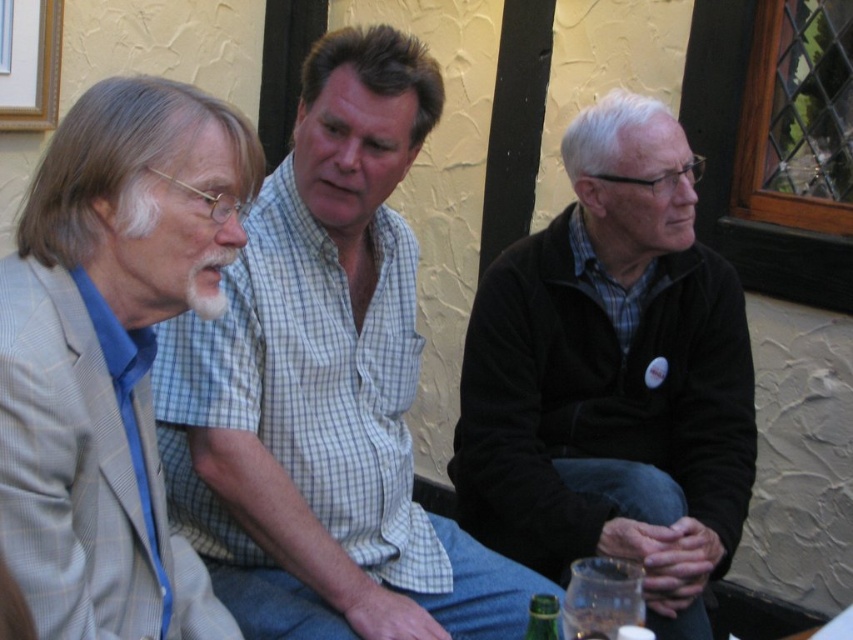
Based on the scene description, where exactly is the black fleece jacket at center located in terms of coordinates?

The black fleece jacket at center is located at the coordinates point (612, 376).

You are a photographer trying to capture a candid shot of the light brown checkered shirt at center and the brushed metal picture frame at upper left. Which object should you focus on first if you want to capture both in a single frame without moving the camera?

The light brown checkered shirt at center is below the brushed metal picture frame at upper left, so you should focus on the brushed metal picture frame at upper left first to ensure both are in the frame without moving the camera.